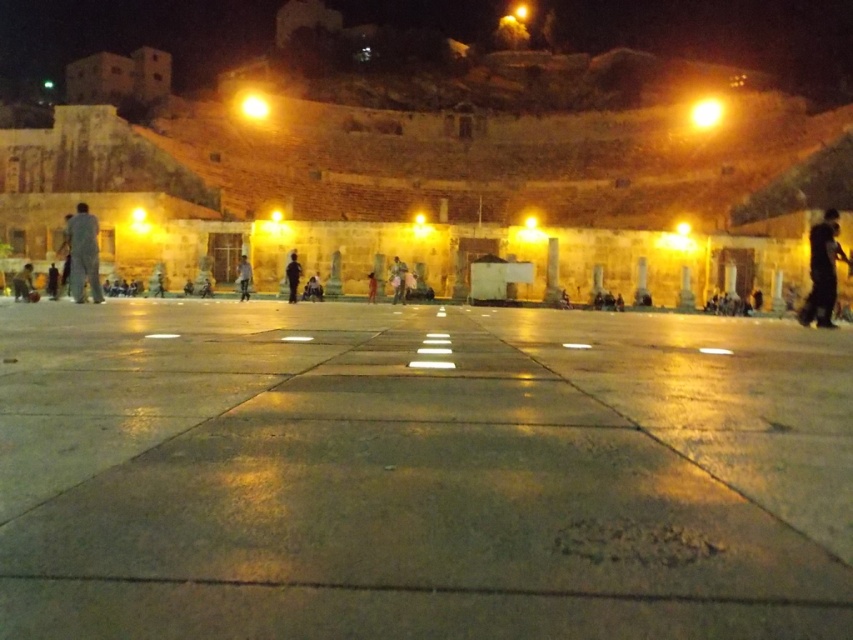
You are standing at the edge of the paved area in the amphitheater and see the smooth stone pillar at center and the light brown leather jacket at lower left. Which object is closer to you?

The light brown leather jacket at lower left is closer to you because the smooth stone pillar at center is positioned over it, indicating it is further away.

You are an event planner setting up for a ceremony in the amphitheater. You need to place a decorative banner between the smooth stone pillar at center and the smooth red dress at center. Which object should the banner be placed closer to the ground?

The banner should be placed closer to the ground near the smooth red dress at center because the smooth stone pillar at center is located above the smooth red dress at center.